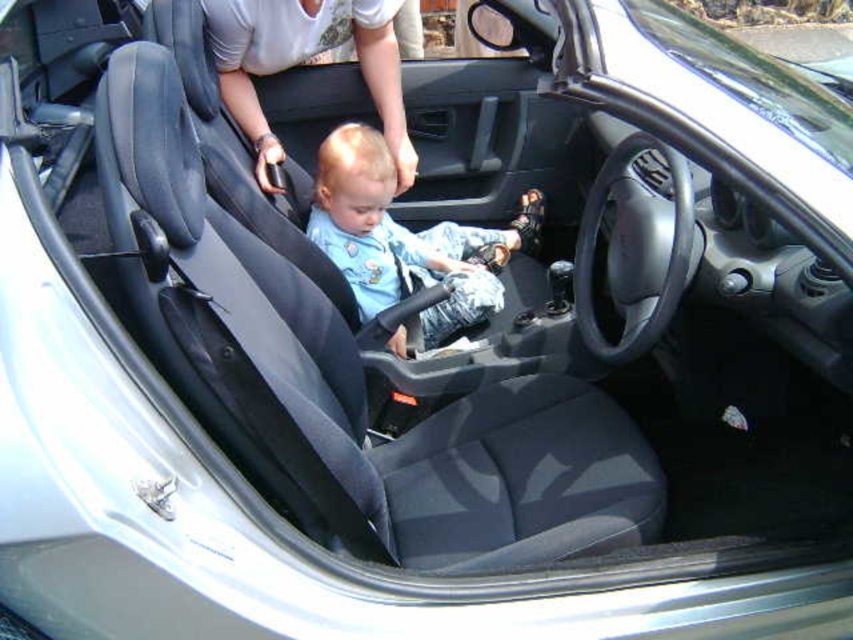
Which of these two, matte blue shirt at center or white fabric shirt at upper center, stands taller?

matte blue shirt at center

Which is above, matte blue shirt at center or white fabric shirt at upper center?

Positioned higher is white fabric shirt at upper center.

In order to click on matte blue shirt at center in this screenshot , I will do `click(405, 237)`.